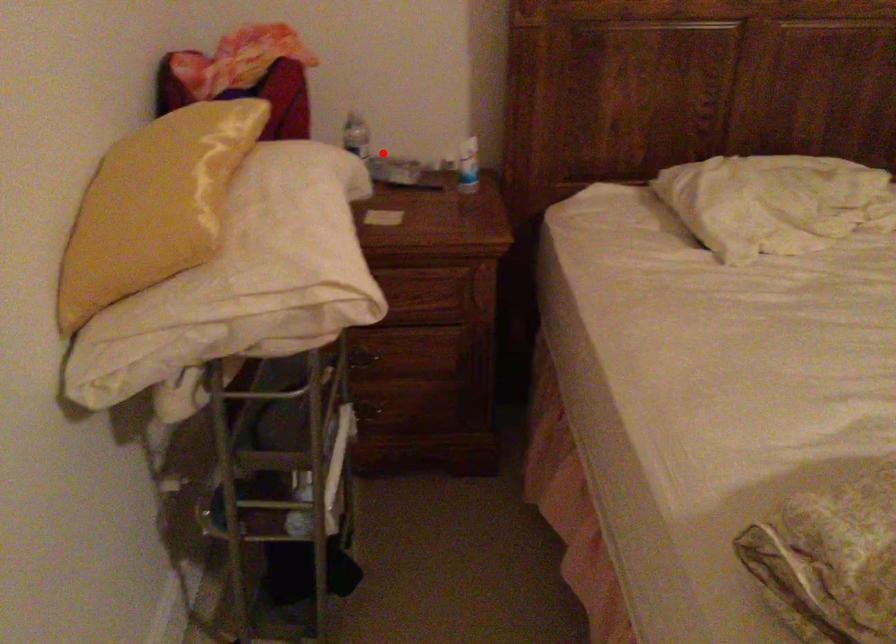
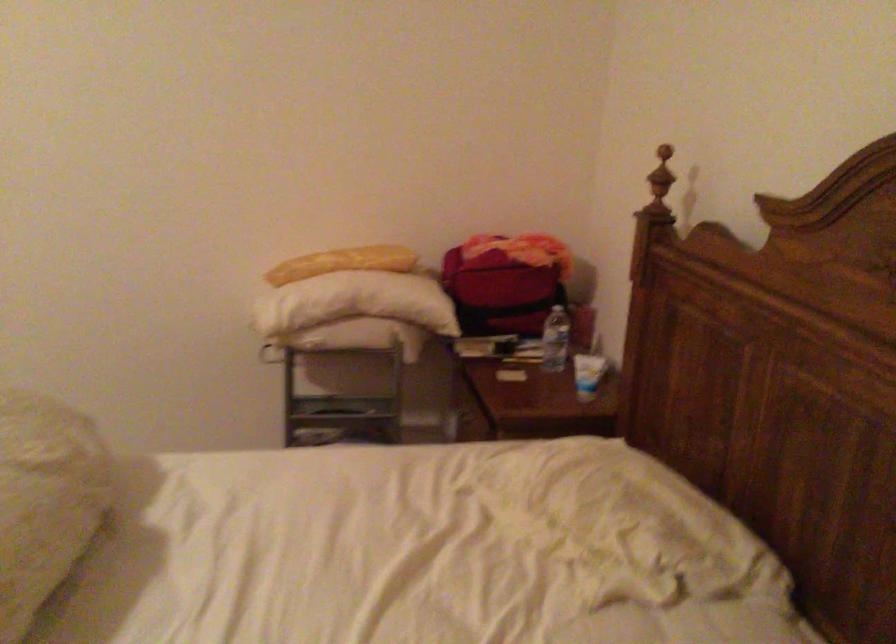
Where in the second image is the point corresponding to the highlighted location from the first image?

(556, 339)